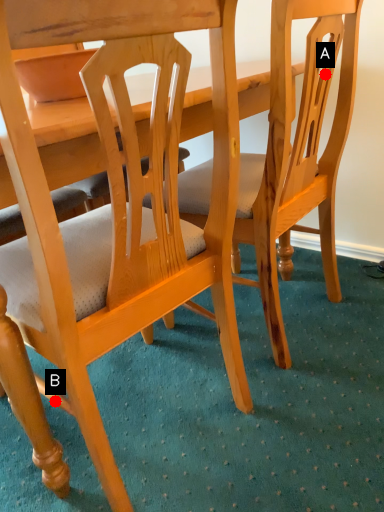
Question: Two points are circled on the image, labeled by A and B beside each circle. Which of the following is the farthest from the observer?

Choices:
 (A) A is further
 (B) B is further

Answer: (A)